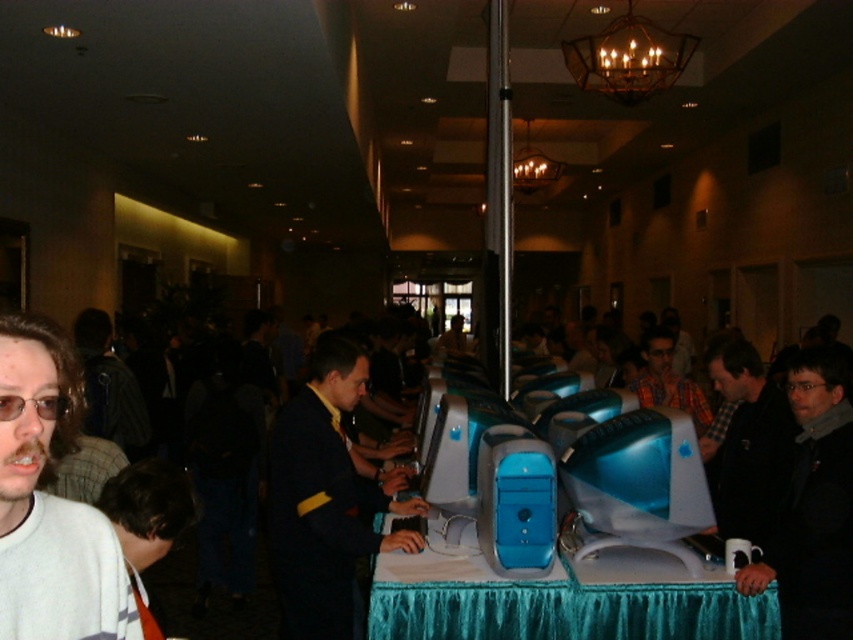
Does black wool sweater at right have a greater width compared to dark blue shirt at center?

Yes.

Is the position of black wool sweater at right less distant than that of dark blue shirt at center?

Yes.

Who is more forward, (804, 468) or (99, 362)?

Positioned in front is point (804, 468).

The height and width of the screenshot is (640, 853). Identify the location of black wool sweater at right. (813, 506).

Between blue glossy monitor at center and plaid shirt at center, which one appears on the right side from the viewer's perspective?

plaid shirt at center is more to the right.

Does blue glossy monitor at center have a lesser height compared to plaid shirt at center?

In fact, blue glossy monitor at center may be taller than plaid shirt at center.

The width and height of the screenshot is (853, 640). What do you see at coordinates (323, 499) in the screenshot?
I see `blue glossy monitor at center` at bounding box center [323, 499].

Locate an element on the screen. blue glossy monitor at center is located at coordinates (323, 499).

Can you confirm if blue glossy monitor at center is smaller than blue plastic monitor at center?

Incorrect, blue glossy monitor at center is not smaller in size than blue plastic monitor at center.

Which is below, blue glossy monitor at center or blue plastic monitor at center?

blue glossy monitor at center is below.

Is point (311, 611) positioned before point (627, 524)?

No.

Find the location of `blue glossy monitor at center`. blue glossy monitor at center is located at coordinates (323, 499).